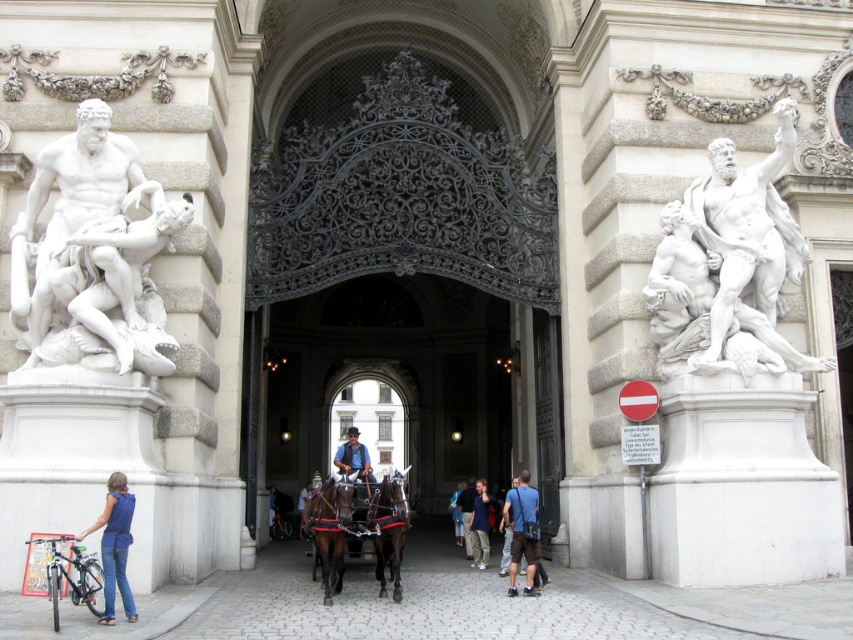
Does point (111, 212) come farther from viewer compared to point (524, 506)?

No, (111, 212) is in front of (524, 506).

The image size is (853, 640). In order to click on white marble statue at left in this screenshot , I will do `click(93, 253)`.

Between white marble statue at left and brown glossy horse at center, which one is positioned lower?

brown glossy horse at center

Is point (102, 168) farther from camera compared to point (341, 557)?

Yes.

Where is `white marble statue at left`? white marble statue at left is located at coordinates (93, 253).

Can you confirm if blue denim jeans at lower left is taller than blue denim jeans at center?

Incorrect, blue denim jeans at lower left's height is not larger of blue denim jeans at center's.

Is blue denim jeans at lower left bigger than blue denim jeans at center?

Actually, blue denim jeans at lower left might be smaller than blue denim jeans at center.

Is point (79, 534) farther from camera compared to point (486, 554)?

That is False.

Locate an element on the screen. Image resolution: width=853 pixels, height=640 pixels. blue denim jeans at lower left is located at coordinates (114, 545).